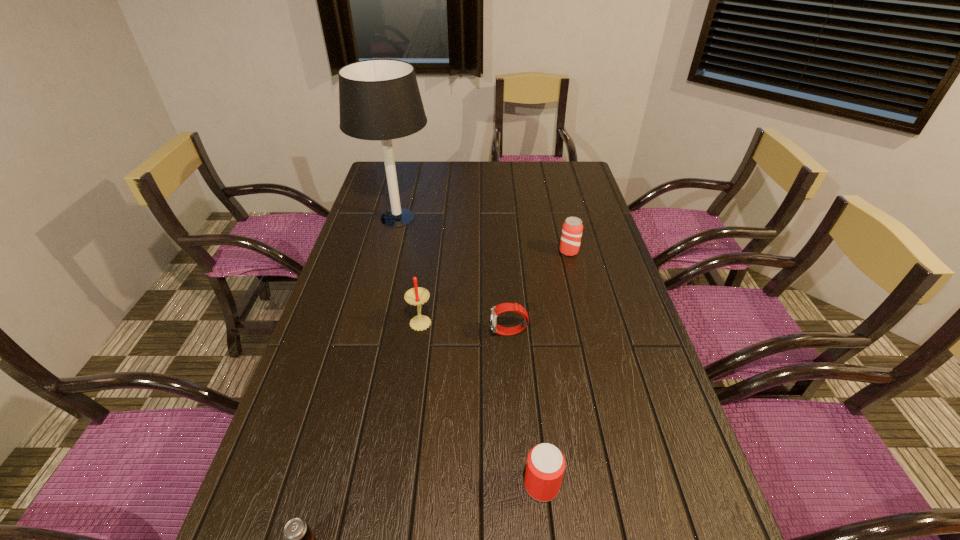
Find the location of `beer can that can be found as the third closest to the watch`. beer can that can be found as the third closest to the watch is located at coordinates (299, 539).

You are a GUI agent. You are given a task and a screenshot of the screen. Output one action in this format:
    pyautogui.click(x=<x>, y=<y>)
    Task: Click on the blank space that satisfies the following two spatial constraints: 1. on the front side of the rightmost object; 2. on the face of the watch
    The width and height of the screenshot is (960, 540).
    Given the screenshot: What is the action you would take?
    [589, 333]